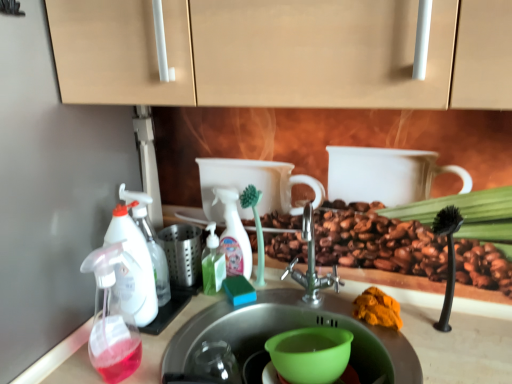
At what (x,y) coordinates should I click in order to perform the action: click on free space between translucent plastic spray bottle at center and orange powder at sink. Please return your answer as a coordinate pair (x, y). The image size is (512, 384). Looking at the image, I should click on (313, 302).